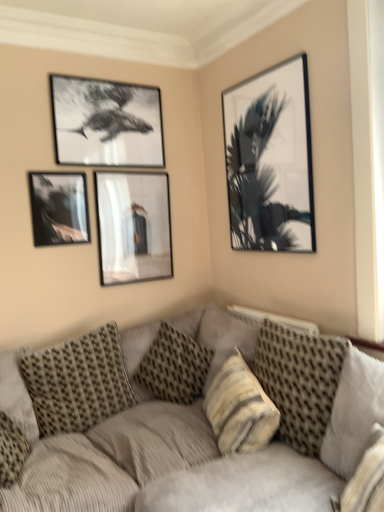
Question: From a real-world perspective, relative to matte glass picture frame at center, which appears as the third picture frame when viewed from the left, is striped fabric pillow at center, arranged as the 4th pillow when viewed from the left, vertically above or below?

Choices:
 (A) above
 (B) below

Answer: (B)

Question: From the image's perspective, is striped fabric pillow at center, arranged as the 4th pillow when viewed from the left, above or below matte glass picture frame at center, placed as the second picture frame when sorted from right to left?

Choices:
 (A) below
 (B) above

Answer: (A)

Question: Which of these objects is positioned farthest from the striped fabric pillow at center, the second pillow viewed from the right?

Choices:
 (A) black glossy helicopter at upper left, the 2th picture frame when ordered from left to right
 (B) matte glass picture frame at center, placed as the second picture frame when sorted from right to left
 (C) textured beige pillow at center, which is counted as the second pillow, starting from the left
 (D) matte black picture frame at lower left, which is the 4th picture frame in right-to-left order
 (E) black matte picture frame at upper right, which appears as the first picture frame when viewed from the right

Answer: (A)

Question: Which of these objects is positioned closest to the textured beige pillow at right, arranged as the 1th pillow when viewed from the right?

Choices:
 (A) textured beige pillow at center, which is counted as the 4th pillow, starting from the right
 (B) striped fabric pillow at center, the second pillow viewed from the right
 (C) textured beige pillow at lower left, which is the fifth pillow from right to left
 (D) patterned fabric pillow at center, which ranks as the third pillow in left-to-right order
 (E) black glossy helicopter at upper left, the 3th picture frame from the right

Answer: (B)